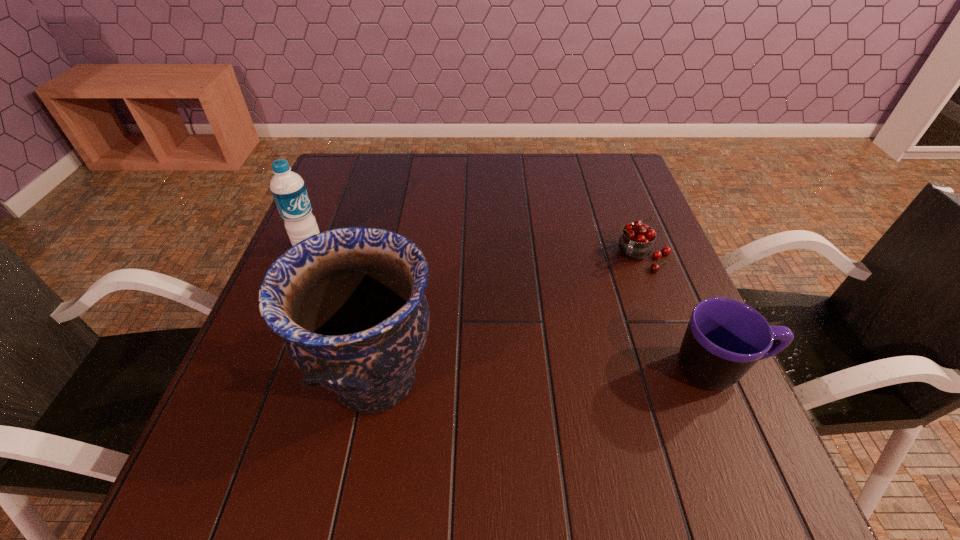
Identify the location of free space between the mug and the pottery. The width and height of the screenshot is (960, 540). coord(547,375).

You are a GUI agent. You are given a task and a screenshot of the screen. Output one action in this format:
    pyautogui.click(x=<x>, y=<y>)
    Task: Click on the free area in between the second object from left to right and the pot filled with cherries
    Image resolution: width=960 pixels, height=540 pixels.
    Given the screenshot: What is the action you would take?
    pyautogui.click(x=508, y=318)

Where is `empty space between the mug and the pot filled with cherries`? The height and width of the screenshot is (540, 960). empty space between the mug and the pot filled with cherries is located at coordinates (680, 313).

Identify the location of unoccupied position between the pot filled with cherries and the mug. This screenshot has height=540, width=960. tap(680, 313).

Identify the location of the closest object to the pot filled with cherries. The width and height of the screenshot is (960, 540). (725, 338).

Locate an element on the screen. The width and height of the screenshot is (960, 540). object that is the third closest one to the mug is located at coordinates (288, 189).

In order to click on vacant space that satisfies the following two spatial constraints: 1. on the front side of the pot filled with cherries; 2. with the handle on the side of the mug in this screenshot , I will do tap(684, 369).

Identify the location of vacant position in the image that satisfies the following two spatial constraints: 1. on the front side of the mug; 2. with the handle on the side of the water bottle. (259, 369).